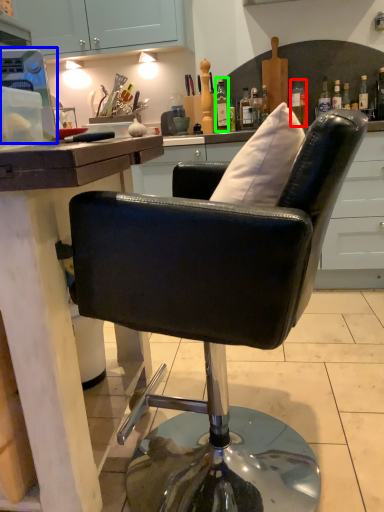
Question: Which is farther away from bottle (highlighted by a red box)? appliance (highlighted by a blue box) or bottle (highlighted by a green box)?

Choices:
 (A) appliance
 (B) bottle

Answer: (A)